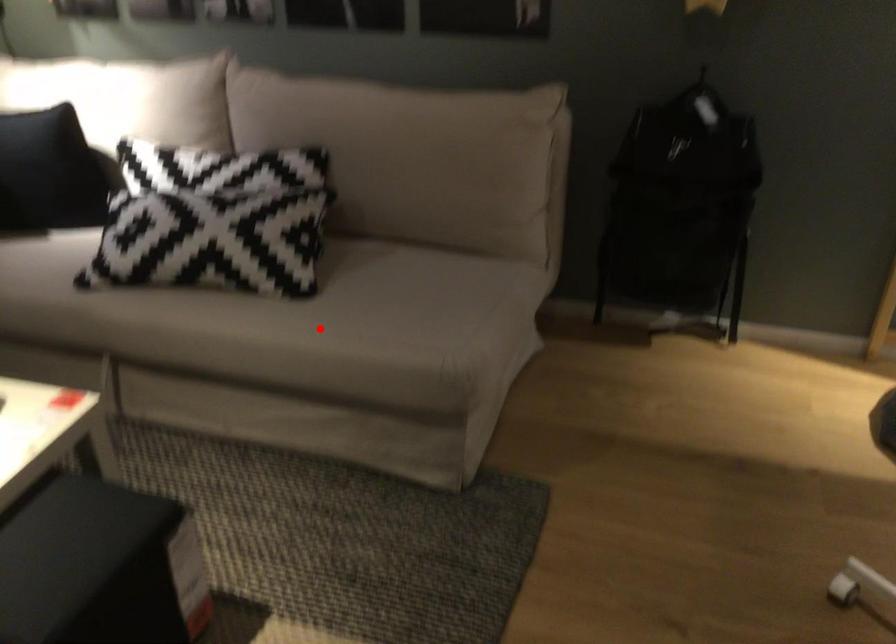
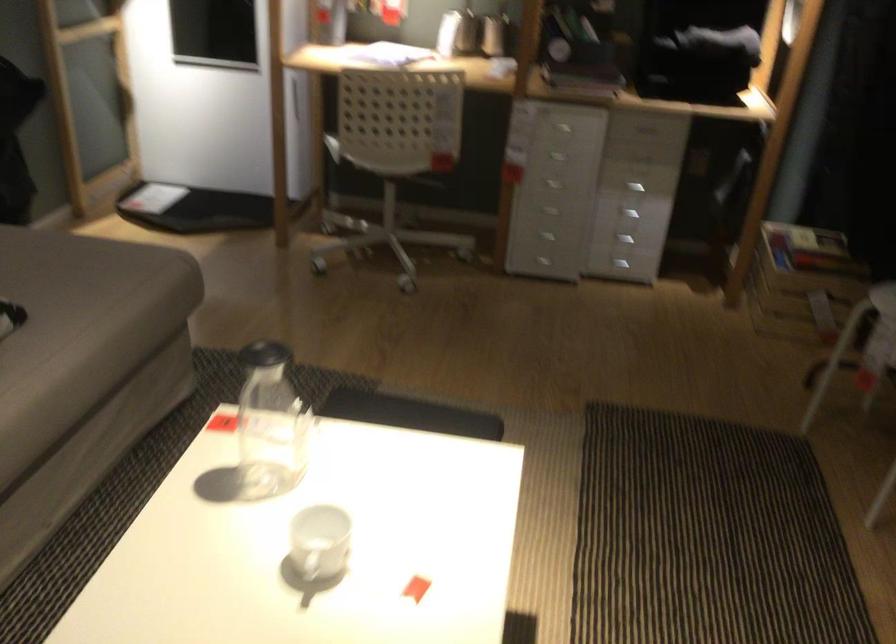
The point at the highlighted location is marked in the first image. Where is the corresponding point in the second image?

(82, 324)